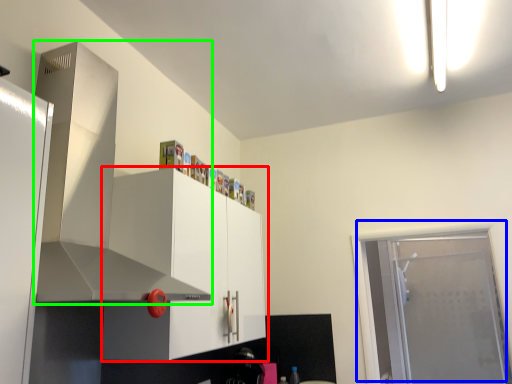
Question: Considering the real-world distances, which object is closest to cabinetry (highlighted by a red box)? door (highlighted by a blue box) or exhaust hood (highlighted by a green box).

Choices:
 (A) door
 (B) exhaust hood

Answer: (B)